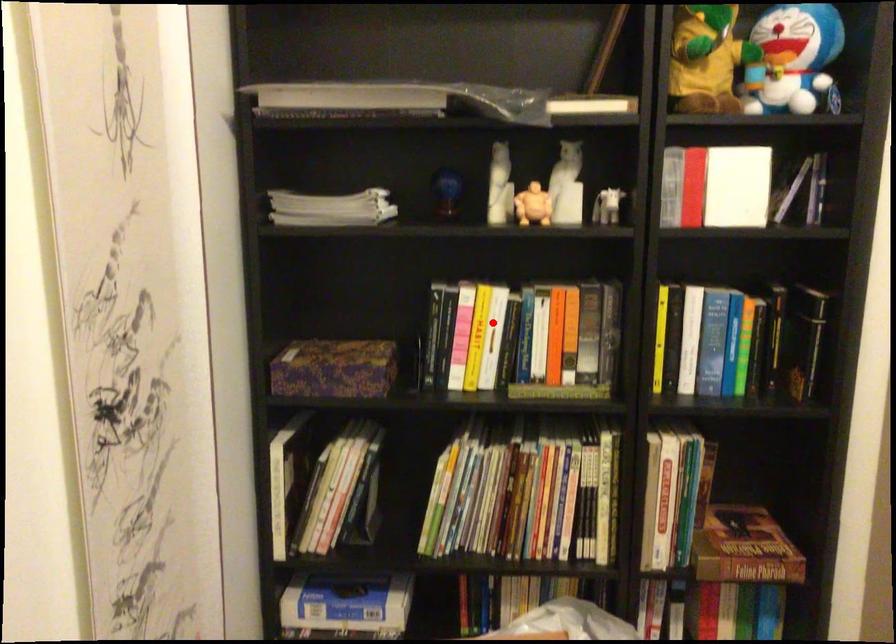
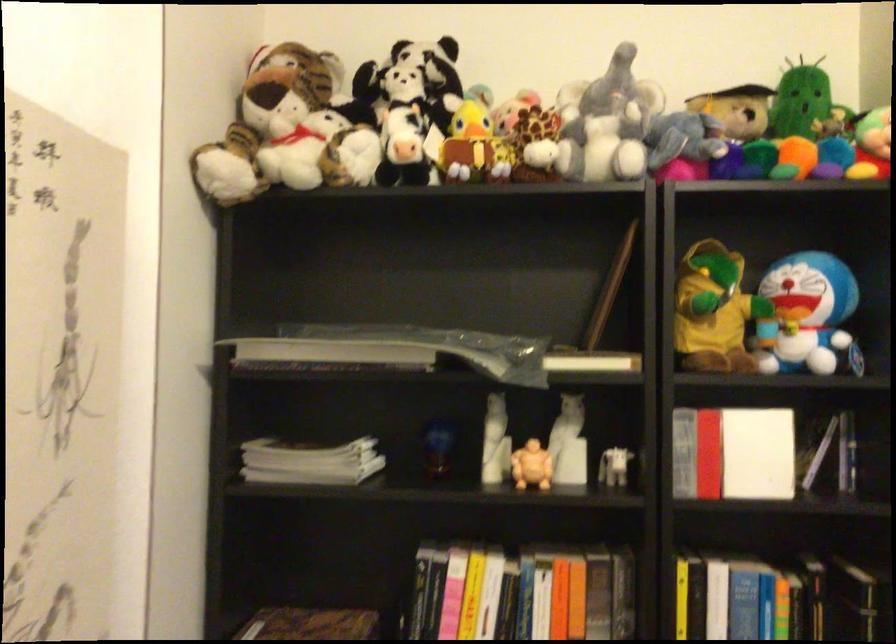
The point at the highlighted location is marked in the first image. Where is the corresponding point in the second image?

(485, 599)